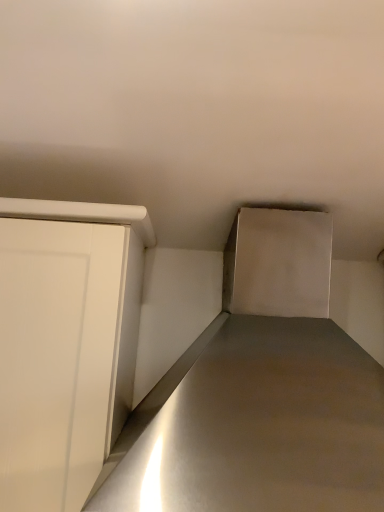
Question: Does white matte door at left lie behind satin silver counter top at center?

Choices:
 (A) yes
 (B) no

Answer: (A)

Question: Is white matte door at left thinner than satin silver counter top at center?

Choices:
 (A) no
 (B) yes

Answer: (B)

Question: Considering the relative sizes of white matte door at left and satin silver counter top at center in the image provided, is white matte door at left bigger than satin silver counter top at center?

Choices:
 (A) yes
 (B) no

Answer: (B)

Question: From the image's perspective, is white matte door at left located beneath satin silver counter top at center?

Choices:
 (A) no
 (B) yes

Answer: (B)

Question: Does white matte door at left have a greater width compared to satin silver counter top at center?

Choices:
 (A) no
 (B) yes

Answer: (A)

Question: Considering the relative positions of white matte door at left and satin silver counter top at center in the image provided, is white matte door at left in front of satin silver counter top at center?

Choices:
 (A) no
 (B) yes

Answer: (A)

Question: Can you confirm if satin silver counter top at center is positioned to the right of white matte door at left?

Choices:
 (A) yes
 (B) no

Answer: (A)

Question: Is satin silver counter top at center turned away from white matte door at left?

Choices:
 (A) yes
 (B) no

Answer: (B)

Question: Is satin silver counter top at center bigger than white matte door at left?

Choices:
 (A) yes
 (B) no

Answer: (A)

Question: Does satin silver counter top at center have a greater width compared to white matte door at left?

Choices:
 (A) yes
 (B) no

Answer: (A)

Question: Is the position of satin silver counter top at center more distant than that of white matte door at left?

Choices:
 (A) no
 (B) yes

Answer: (A)

Question: From a real-world perspective, is satin silver counter top at center beneath white matte door at left?

Choices:
 (A) yes
 (B) no

Answer: (B)

Question: From a real-world perspective, is satin silver counter top at center positioned above or below white matte door at left?

Choices:
 (A) above
 (B) below

Answer: (A)